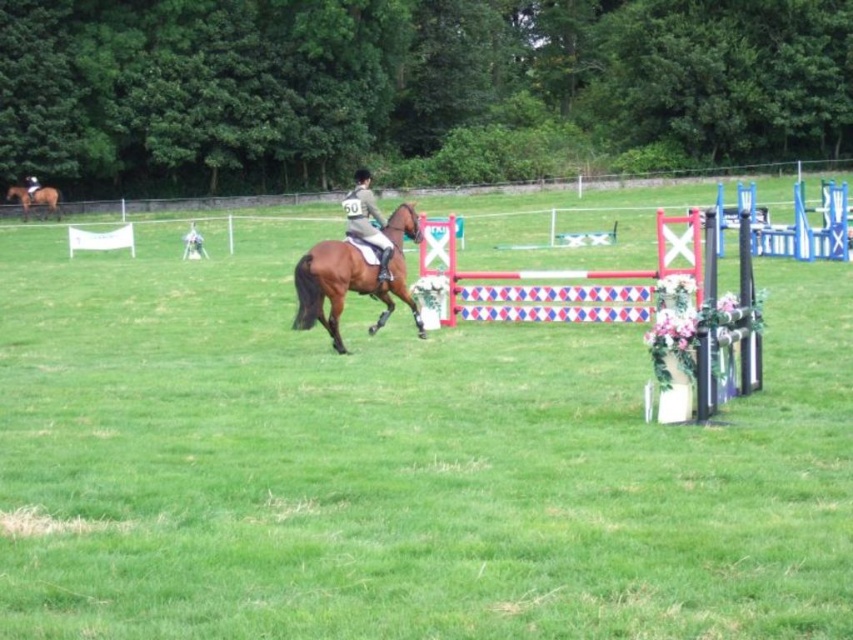
Question: Which point appears farthest from the camera in this image?

Choices:
 (A) (30, 196)
 (B) (35, 202)
 (C) (321, 278)

Answer: (B)

Question: Is the position of brown glossy horse at center more distant than that of dark brown leather jacket at center?

Choices:
 (A) yes
 (B) no

Answer: (B)

Question: Is light brown leather jacket at center above dark brown leather jacket at center?

Choices:
 (A) yes
 (B) no

Answer: (B)

Question: In this image, where is light brown leather jacket at center located relative to dark brown leather jacket at center?

Choices:
 (A) below
 (B) above

Answer: (A)

Question: Among these objects, which one is nearest to the camera?

Choices:
 (A) brown glossy horse at upper left
 (B) light brown leather jacket at center
 (C) brown glossy horse at center

Answer: (C)

Question: Which object appears closest to the camera in this image?

Choices:
 (A) brown glossy horse at upper left
 (B) light brown leather jacket at center
 (C) brown glossy horse at center

Answer: (C)